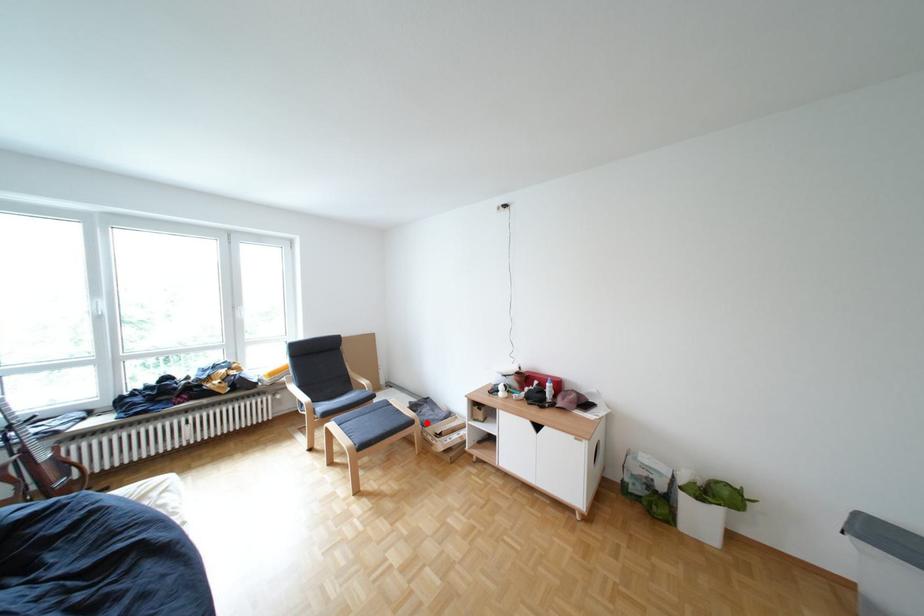
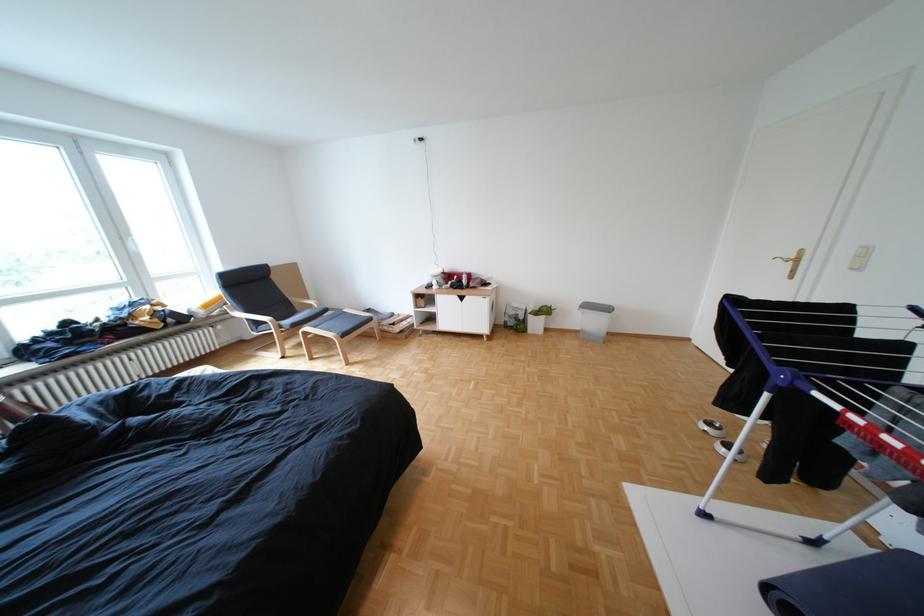
Question: A red point is marked in image1. In image2, is the corresponding 3D point closer to the camera or farther? Reply with the corresponding letter.

Choices:
 (A) The corresponding 3D point is closer.
 (B) The corresponding 3D point is farther.

Answer: (B)